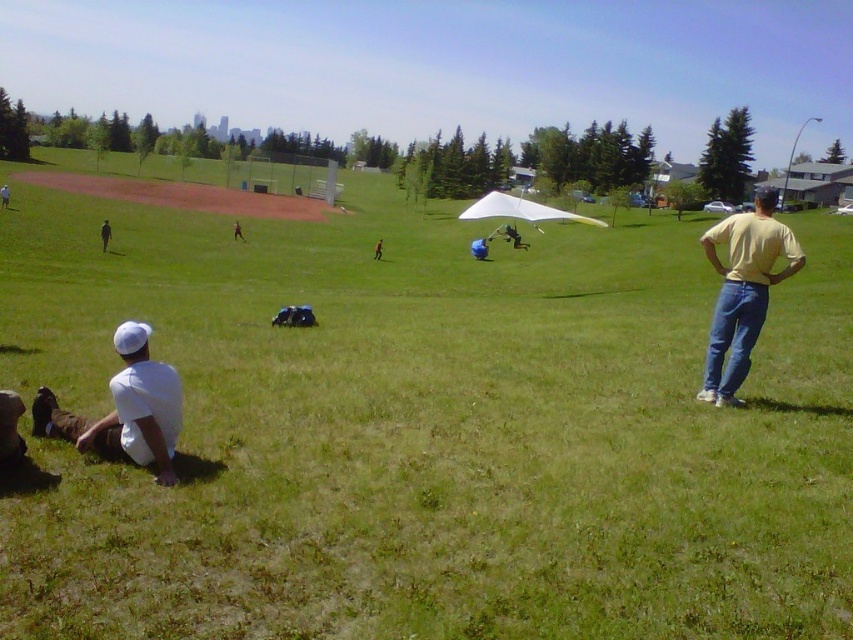
You are a photographer positioned at the edge of the park. You want to take a photo of the white matte shirt at lower left and the brown fabric backpack at center. Which object should you focus on first to ensure both are in sharp focus?

The white matte shirt at lower left is closer to the viewer than the brown fabric backpack at center, so focus on the white matte shirt at lower left first to ensure both are in sharp focus.

You are organizing a charity event in the park and need to place a small donation box. The box is 0.5 meters wide. You have space between the white matte shirt at lower left and the brown fabric backpack at center. Can the box fit there?

The white matte shirt at lower left has a smaller size compared to the brown fabric backpack at center. Since the box is 0.5 meters wide, the space between them may be sufficient if the distance between the shirt and backpack is at least 0.5 meters. However, the exact distance isn